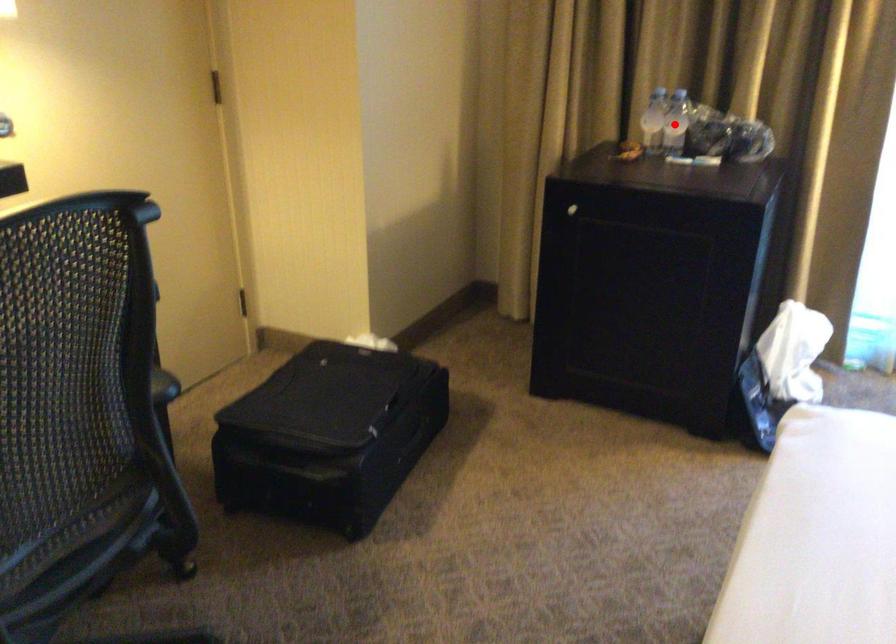
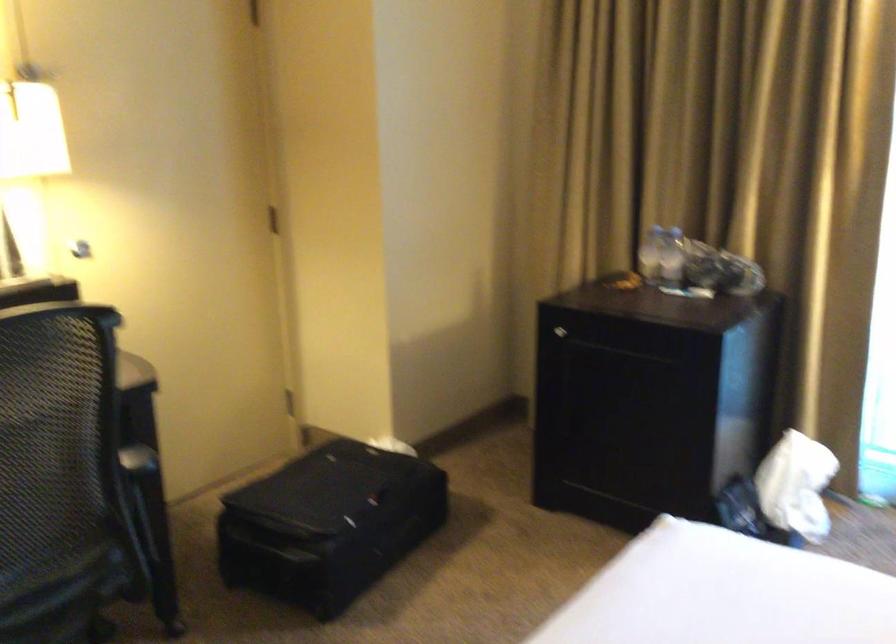
In the second image, find the point that corresponds to the highlighted location in the first image.

(670, 257)